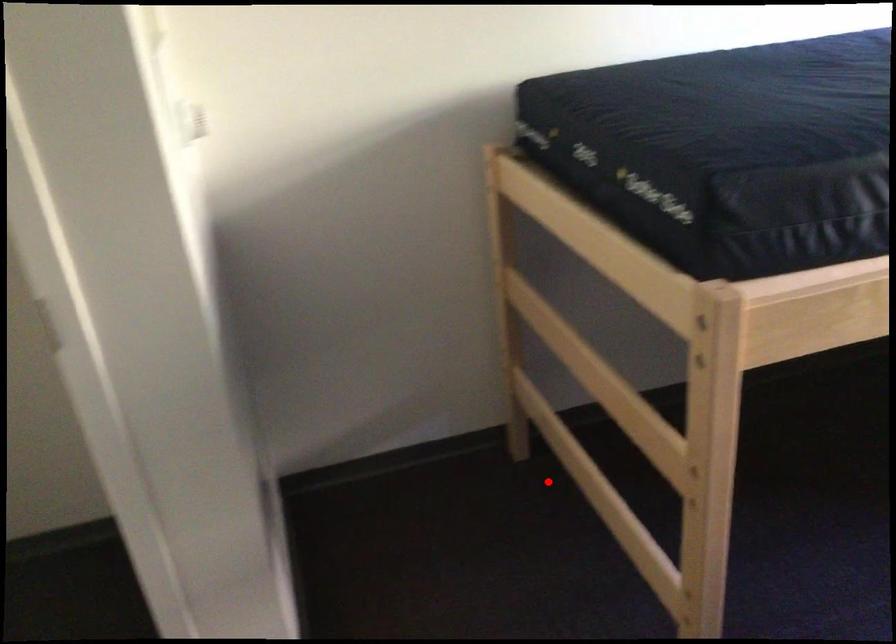
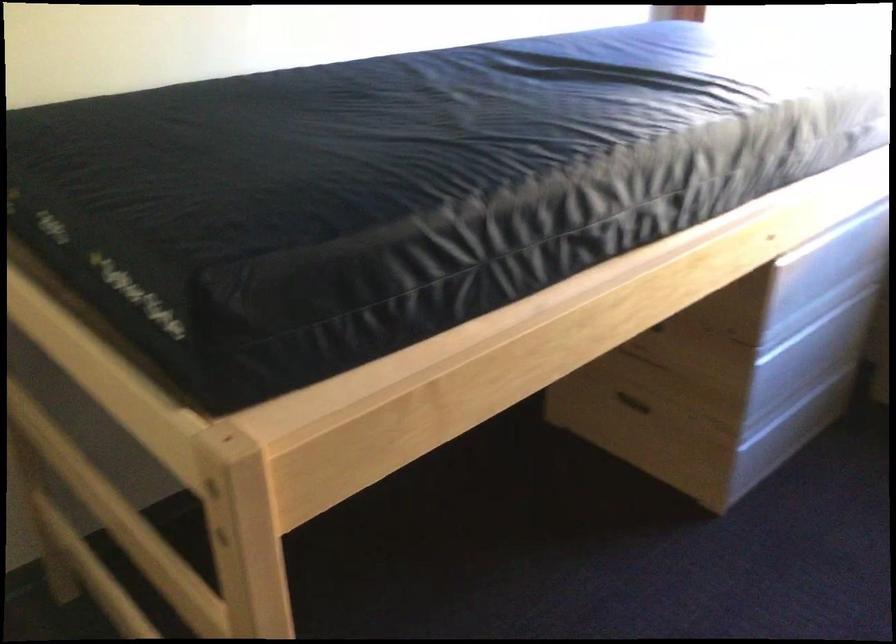
Locate, in the second image, the point that corresponds to the highlighted location in the first image.

(112, 632)